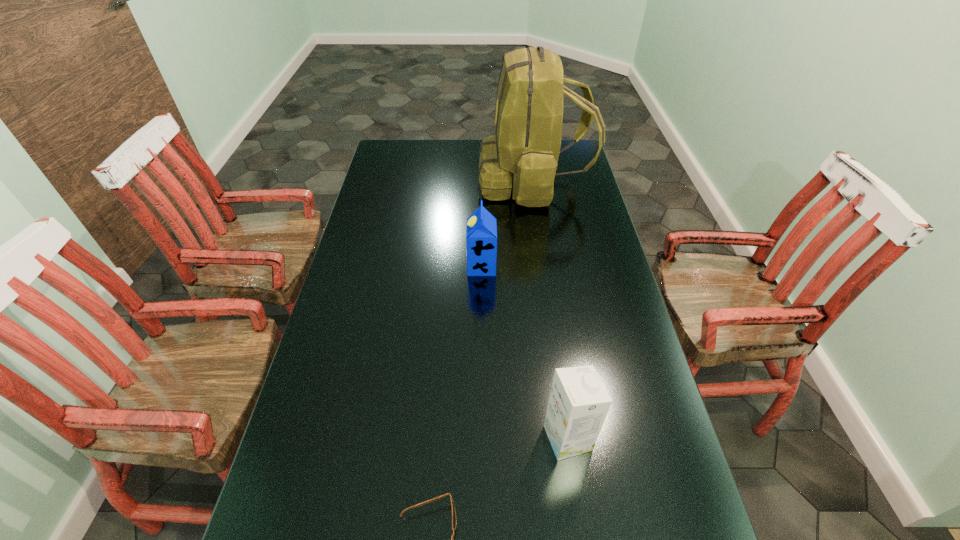
Where is `vacant space located with the cap open on the second farthest object`? vacant space located with the cap open on the second farthest object is located at coordinates (368, 266).

Where is `vacant space located 0.270m with the cap open on the second farthest object`? This screenshot has height=540, width=960. vacant space located 0.270m with the cap open on the second farthest object is located at coordinates (384, 266).

Image resolution: width=960 pixels, height=540 pixels. Find the location of `vacant space situated with the cap open on the second farthest object`. vacant space situated with the cap open on the second farthest object is located at coordinates (405, 266).

Find the location of a particular element. The image size is (960, 540). object located at the far edge is located at coordinates (523, 155).

Locate an element on the screen. This screenshot has height=540, width=960. object at the right edge is located at coordinates (523, 155).

Identify the location of object that is positioned at the far right corner. This screenshot has height=540, width=960. (523, 155).

The width and height of the screenshot is (960, 540). I want to click on vacant space at the far edge, so click(463, 158).

This screenshot has height=540, width=960. Find the location of `vacant space at the left edge`. vacant space at the left edge is located at coordinates (346, 283).

Image resolution: width=960 pixels, height=540 pixels. Find the location of `vacant area at the right edge of the desktop`. vacant area at the right edge of the desktop is located at coordinates (580, 319).

In the image, there is a desktop. Identify the location of blank space at the far left corner. (393, 148).